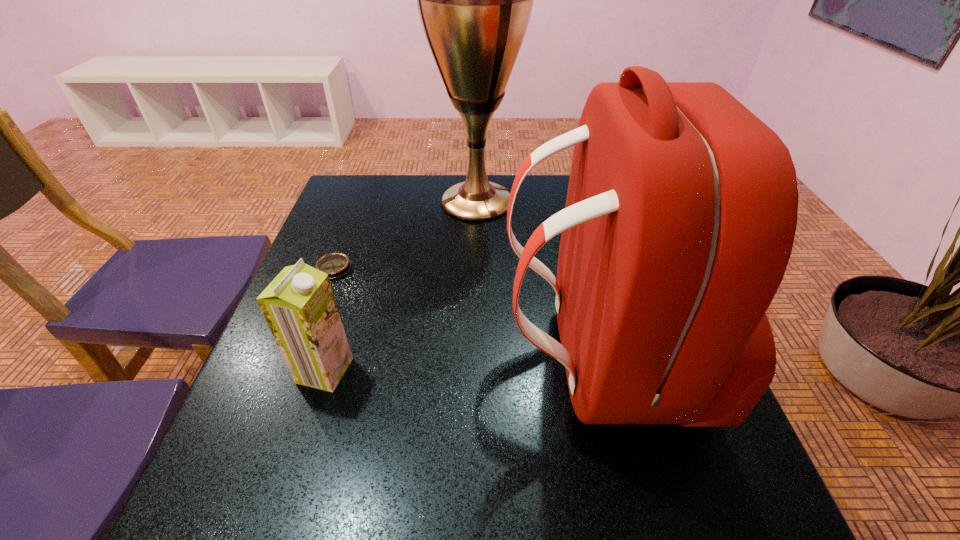
At what (x,y) coordinates should I click in order to perform the action: click on the farthest object. Please return your answer as a coordinate pair (x, y). The height and width of the screenshot is (540, 960). Looking at the image, I should click on (475, 0).

What are the coordinates of `backpack` in the screenshot? It's located at (681, 211).

Locate an element on the screen. soya milk is located at coordinates (299, 306).

At what (x,y) coordinates should I click in order to perform the action: click on the shortest object. Please return your answer as a coordinate pair (x, y). Looking at the image, I should click on (336, 265).

Where is `the second farthest object`? The width and height of the screenshot is (960, 540). the second farthest object is located at coordinates (336, 265).

The width and height of the screenshot is (960, 540). Identify the location of vacant space located on the front of the trophy cup. (476, 277).

I want to click on vacant space located 0.200m on the strap side of the backpack, so pos(403,359).

Find the location of a particular element. The width and height of the screenshot is (960, 540). free space located 0.380m on the strap side of the backpack is located at coordinates (312, 359).

Find the location of a particular element. This screenshot has height=540, width=960. vacant space situated 0.170m on the strap side of the backpack is located at coordinates (419, 359).

At what (x,y) coordinates should I click in order to perform the action: click on vacant space positioned on the front of the third tallest object. Please return your answer as a coordinate pair (x, y). The height and width of the screenshot is (540, 960). Looking at the image, I should click on (310, 417).